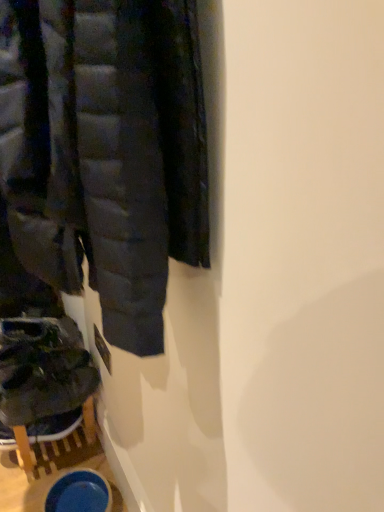
Question: Is matte black jacket at left taller or shorter than dark gray suede shoes at lower left?

Choices:
 (A) short
 (B) tall

Answer: (B)

Question: From a real-world perspective, is matte black jacket at left above or below dark gray suede shoes at lower left?

Choices:
 (A) below
 (B) above

Answer: (B)

Question: Is point (26, 23) positioned closer to the camera than point (11, 378)?

Choices:
 (A) closer
 (B) farther

Answer: (A)

Question: Is point (84, 380) positioned closer to the camera than point (76, 162)?

Choices:
 (A) farther
 (B) closer

Answer: (A)

Question: From a real-world perspective, is dark gray suede shoes at lower left positioned above or below matte black jacket at left?

Choices:
 (A) below
 (B) above

Answer: (A)

Question: Looking at their shapes, would you say dark gray suede shoes at lower left is wider or thinner than matte black jacket at left?

Choices:
 (A) wide
 (B) thin

Answer: (A)

Question: Is dark gray suede shoes at lower left bigger or smaller than matte black jacket at left?

Choices:
 (A) big
 (B) small

Answer: (B)